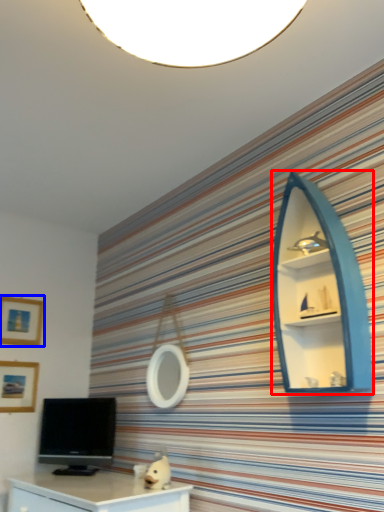
Question: Which point is further to the camera, shelf (highlighted by a red box) or picture frame (highlighted by a blue box)?

Choices:
 (A) shelf
 (B) picture frame

Answer: (B)